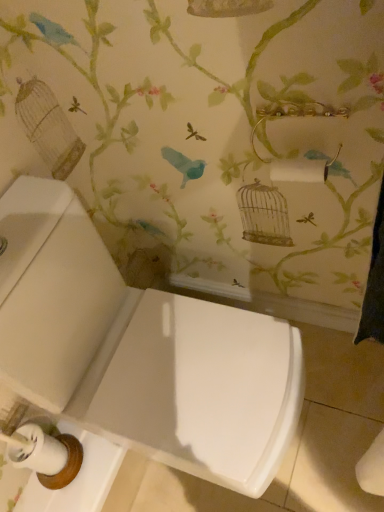
Describe the element at coordinates (140, 350) in the screenshot. I see `white glossy toilet at lower left` at that location.

You are a GUI agent. You are given a task and a screenshot of the screen. Output one action in this format:
    pyautogui.click(x=<x>, y=<y>)
    Task: Click on the white glossy toilet at lower left
    
    Given the screenshot: What is the action you would take?
    pyautogui.click(x=140, y=350)

Locate an element on the screen. The image size is (384, 512). white glossy toilet at lower left is located at coordinates (140, 350).